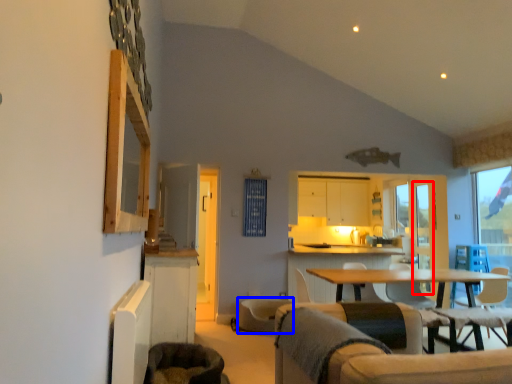
Question: Which of the following is the closest to the observer, screen door (highlighted by a red box) or swivel chair (highlighted by a blue box)?

Choices:
 (A) screen door
 (B) swivel chair

Answer: (B)